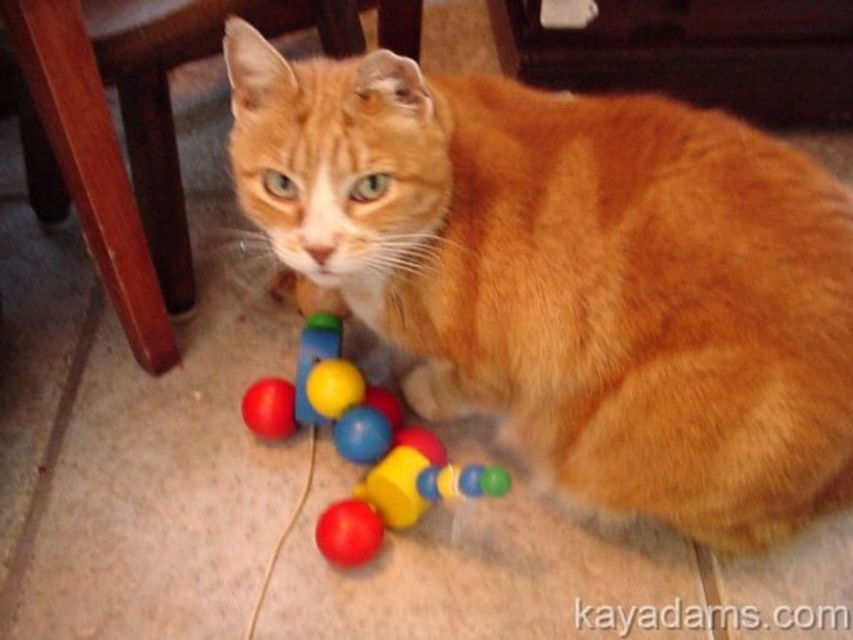
You are a cat owner trying to find the nearest bead to your cat. The cat is sitting at the origin point. The two beads are located at coordinates point (178, 180) and point (436, 451). Which bead is closer to the cat?

Point (178, 180) is closer to the cat because it is further to the viewer than point (436, 451). Since the cat is at the origin, the bead closer to the viewer would have a smaller distance.

You are a cat owner who wants to place the smooth plastic toy at lower center on the wooden chair at lower left. Based on their sizes, will the toy fit on the chair?

The wooden chair at lower left is larger in size than the smooth plastic toy at lower center, so the toy will fit on the chair.